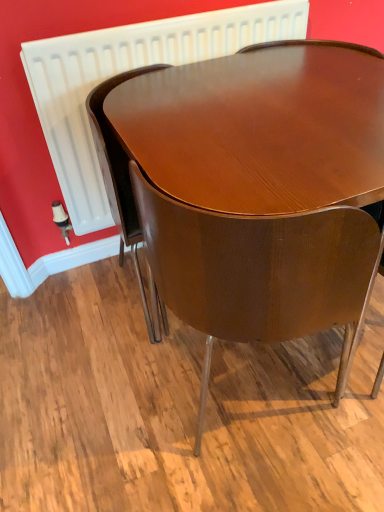
Identify the location of vacant area that lies in front of glossy wood chair at center, the 2th chair viewed from the right. (126, 364).